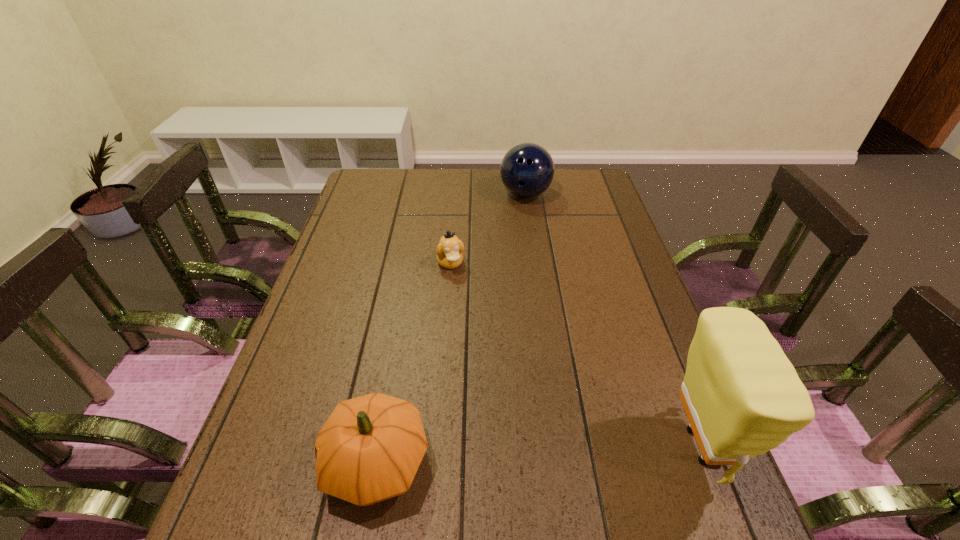
Find the location of a particular element. The image size is (960, 540). vacant space that satisfies the following two spatial constraints: 1. on the front side of the tallest object; 2. on the face of the shortest object is located at coordinates (437, 446).

This screenshot has height=540, width=960. In order to click on free region that satisfies the following two spatial constraints: 1. on the front side of the second farthest object; 2. on the face of the sponge in this screenshot , I will do `click(437, 446)`.